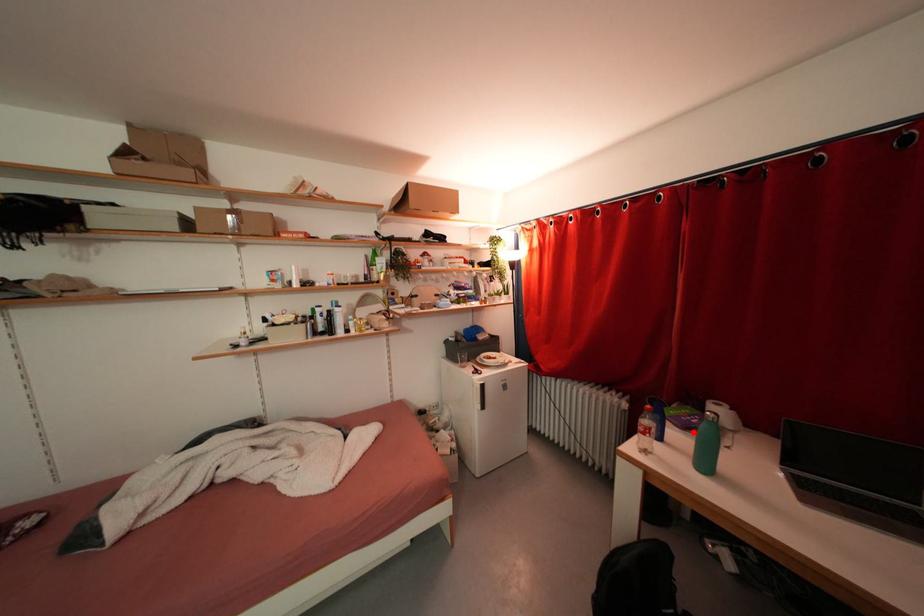
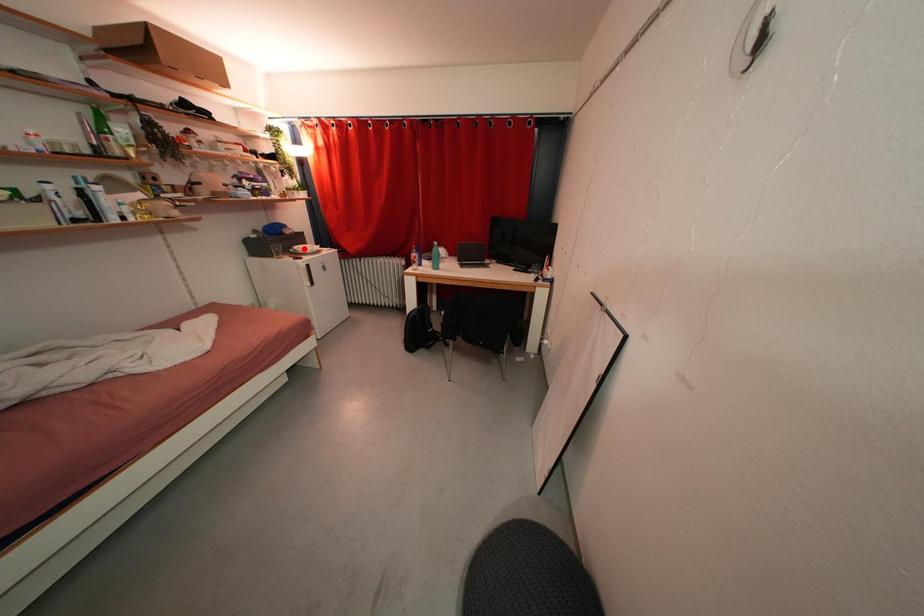
Looking at this image, I am providing you with two images of the same scene from different viewpoints. A red point is marked on the first image and another point is marked on the second image. Is the marked point in image1 the same physical position as the marked point in image2?

No